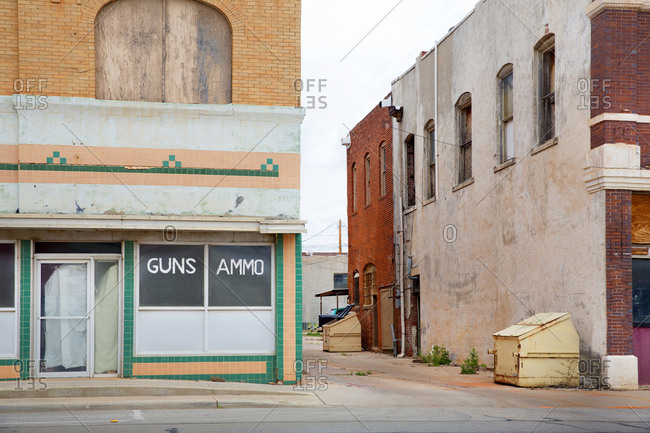
At what (x,y) coordinates should I click in order to perform the action: click on doors. Please return your answer as a coordinate pair (x, y). The image size is (650, 433). Looking at the image, I should click on click(70, 313), click(415, 309), click(372, 313).